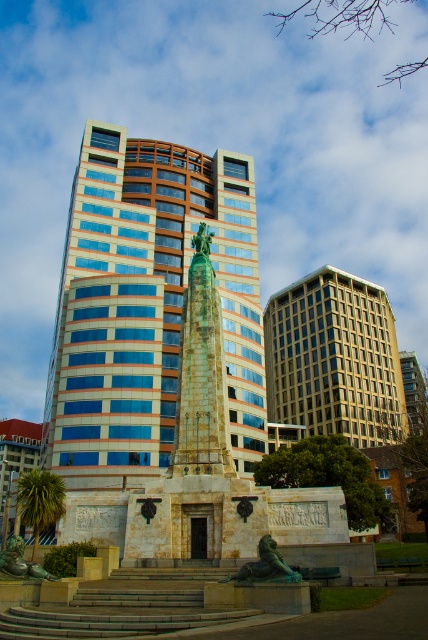
Question: Considering the real-world distances, which object is farthest from the green patina statue at center?

Choices:
 (A) blue glass building at center
 (B) beige glass building at center

Answer: (B)

Question: From the image, what is the correct spatial relationship of blue glass building at center in relation to green patina lion at center?

Choices:
 (A) below
 (B) above

Answer: (B)

Question: Can you confirm if blue glass building at center is wider than green patina bronze statue at center?

Choices:
 (A) yes
 (B) no

Answer: (A)

Question: Which object is positioned farthest from the green patina bronze statue at center?

Choices:
 (A) blue glass building at center
 (B) beige glass building at center
 (C) green patina lion at center

Answer: (B)

Question: Among these points, which one is nearest to the camera?

Choices:
 (A) (282, 563)
 (B) (285, 348)
 (C) (17, 552)
 (D) (148, 220)

Answer: (A)

Question: Is blue glass building at center to the left of beige glass building at center from the viewer's perspective?

Choices:
 (A) yes
 (B) no

Answer: (A)